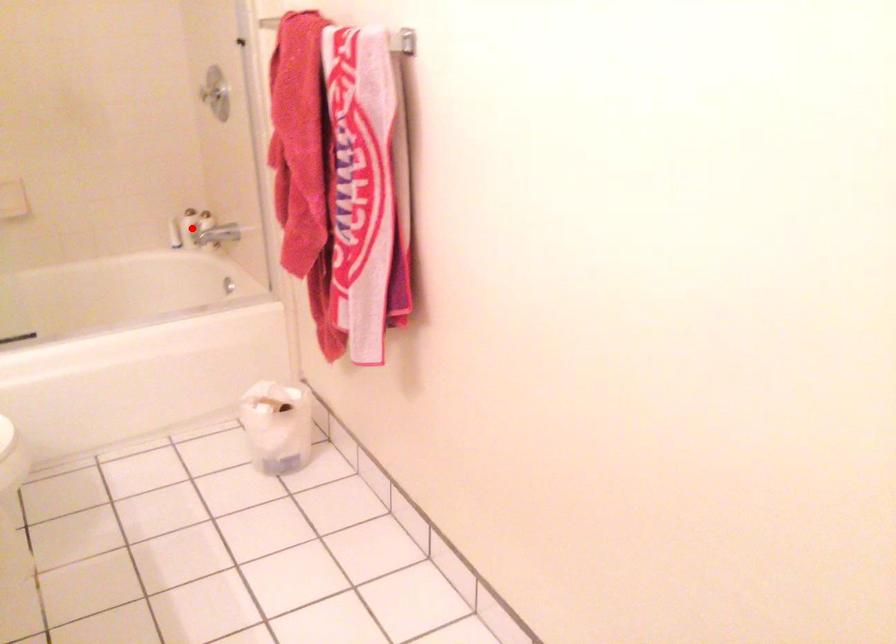
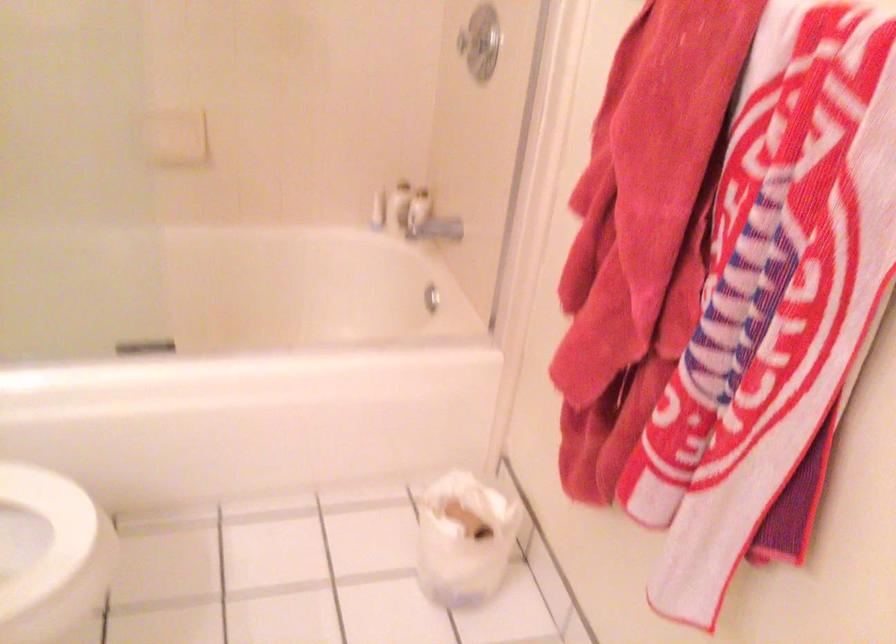
Question: A red point is marked in image1. In image2, is the corresponding 3D point closer to the camera or farther? Reply with the corresponding letter.

Choices:
 (A) The corresponding 3D point is closer.
 (B) The corresponding 3D point is farther.

Answer: (A)